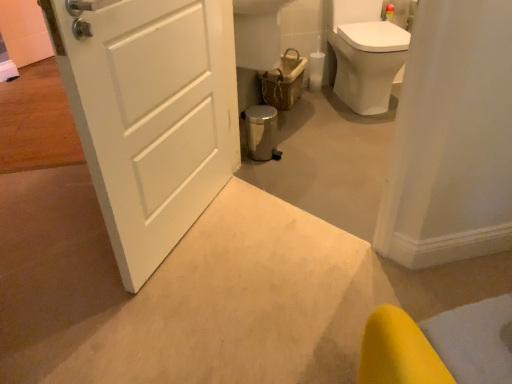
The image size is (512, 384). What are the coordinates of `free space that is in between white glossy toilet at upper right and woven brown basket at center` in the screenshot? It's located at (321, 108).